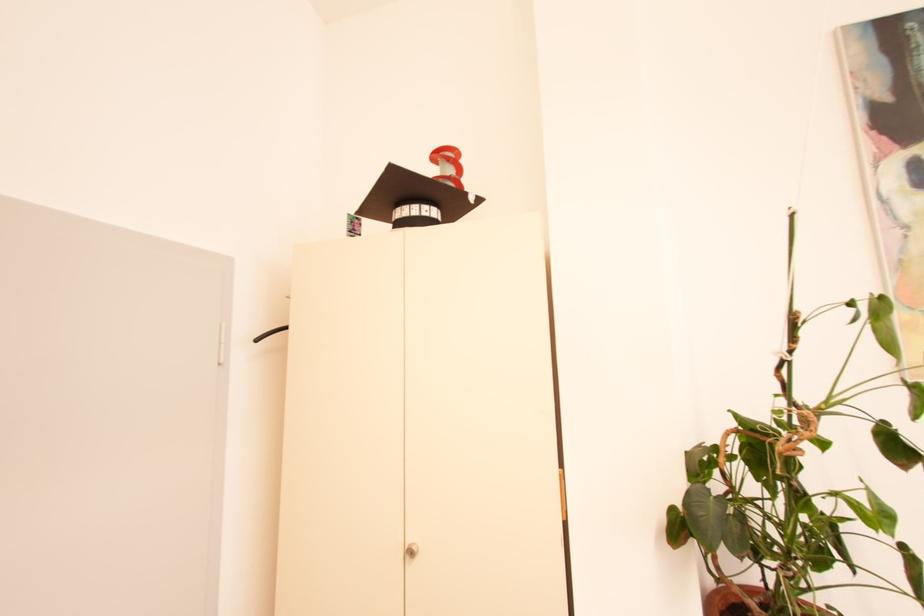
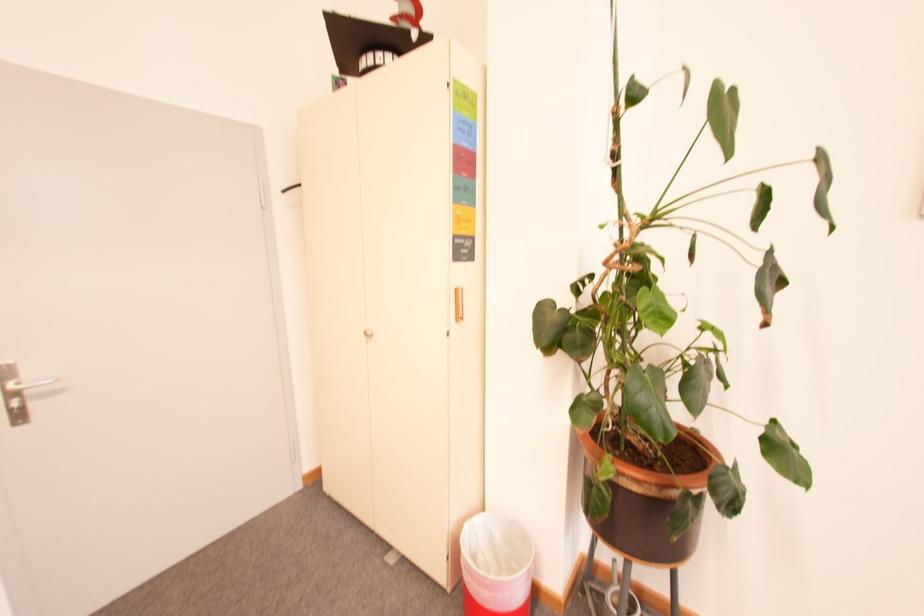
The images are taken continuously from a first-person perspective. In which direction is your viewpoint rotating?

The camera's rotation is toward left-down.